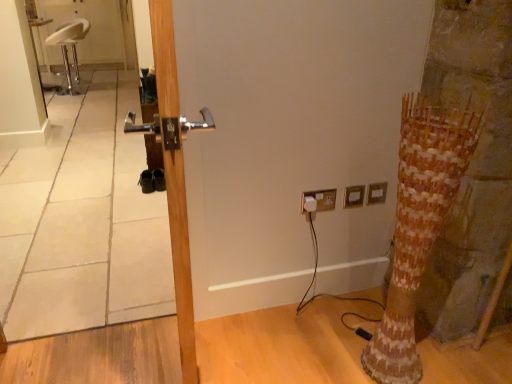
Question: Is metallic silver mirror at left inside wooden door at center?

Choices:
 (A) yes
 (B) no

Answer: (B)

Question: Does wooden door at center have a lesser height compared to metallic silver mirror at left?

Choices:
 (A) yes
 (B) no

Answer: (B)

Question: Is wooden door at center smaller than metallic silver mirror at left?

Choices:
 (A) no
 (B) yes

Answer: (A)

Question: From the image's perspective, is wooden door at center on metallic silver mirror at left?

Choices:
 (A) yes
 (B) no

Answer: (B)

Question: Can you confirm if wooden door at center is positioned to the right of metallic silver mirror at left?

Choices:
 (A) yes
 (B) no

Answer: (A)

Question: From a real-world perspective, is wooden door at center below metallic silver mirror at left?

Choices:
 (A) yes
 (B) no

Answer: (B)

Question: Would you say wooden door at center contains wooden textured tree trunk at right?

Choices:
 (A) yes
 (B) no

Answer: (B)

Question: From the image's perspective, is wooden door at center on top of wooden textured tree trunk at right?

Choices:
 (A) yes
 (B) no

Answer: (A)

Question: Is wooden door at center located outside wooden textured tree trunk at right?

Choices:
 (A) yes
 (B) no

Answer: (A)

Question: From the image's perspective, is wooden door at center beneath wooden textured tree trunk at right?

Choices:
 (A) yes
 (B) no

Answer: (B)

Question: Is wooden door at center directly adjacent to wooden textured tree trunk at right?

Choices:
 (A) no
 (B) yes

Answer: (A)

Question: Does wooden door at center have a smaller size compared to wooden textured tree trunk at right?

Choices:
 (A) no
 (B) yes

Answer: (A)

Question: Is gold metallic electric outlet at upper right, the 2th electric outlet in the left-to-right sequence, at the right side of white plastic electric outlet at upper right, which is the 1th electric outlet from right to left?

Choices:
 (A) yes
 (B) no

Answer: (B)